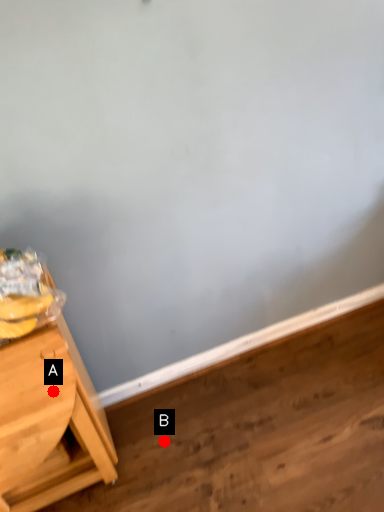
Question: Two points are circled on the image, labeled by A and B beside each circle. Which of the following is the closest to the observer?

Choices:
 (A) A is closer
 (B) B is closer

Answer: (A)